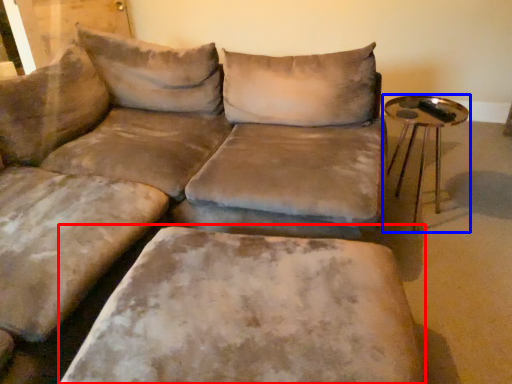
Question: Among these objects, which one is nearest to the camera, swivel chair (highlighted by a red box) or table (highlighted by a blue box)?

Choices:
 (A) swivel chair
 (B) table

Answer: (A)